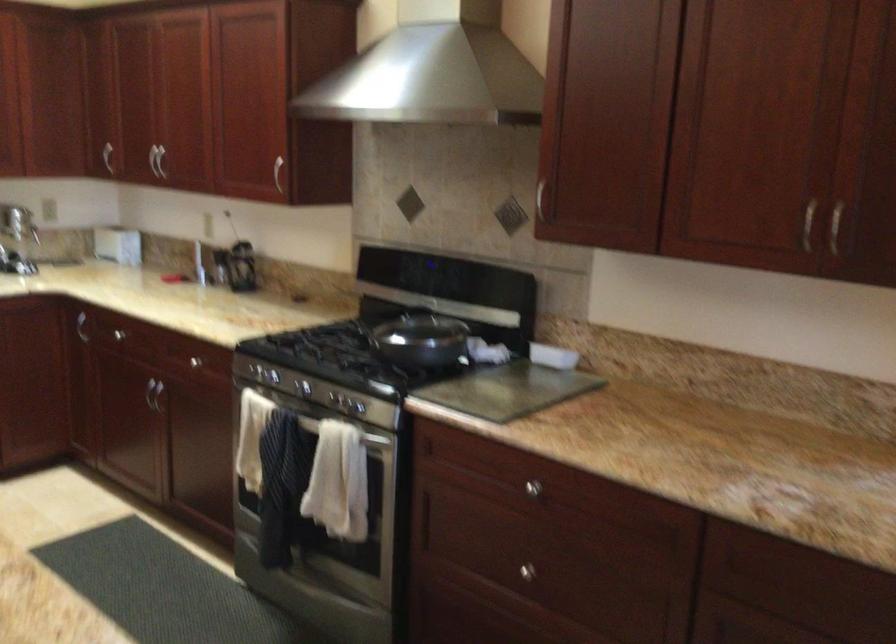
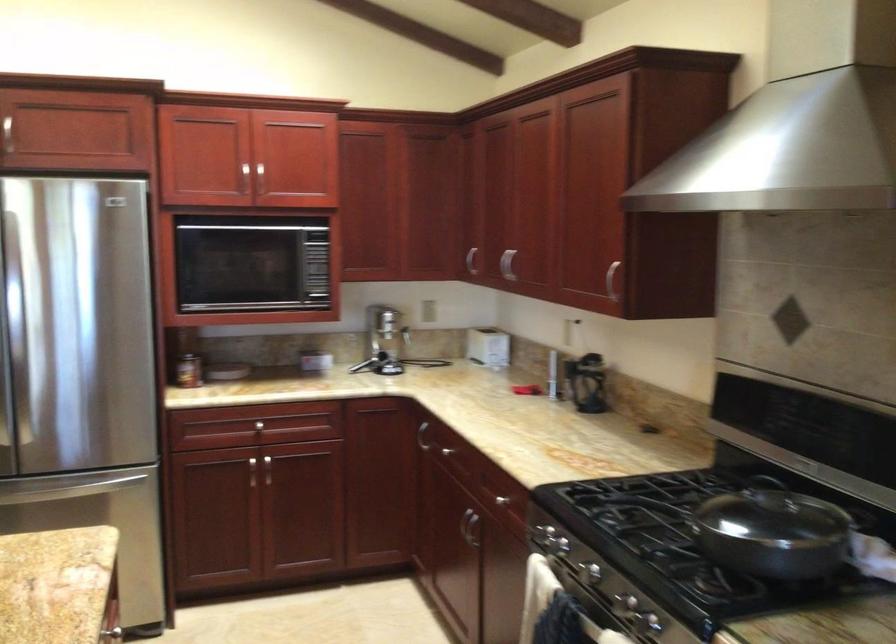
Find the pixel in the second image that matches (101,147) in the first image.

(471, 261)